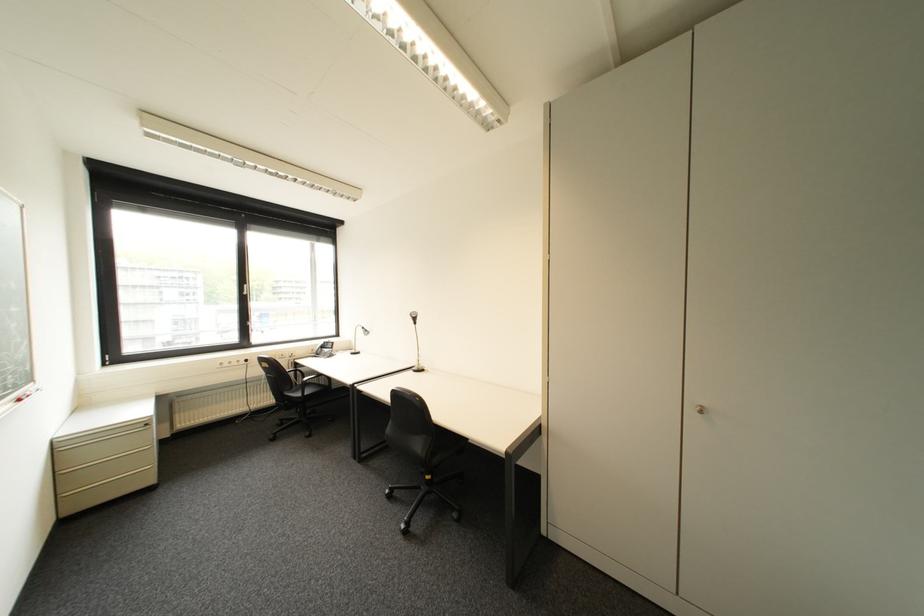
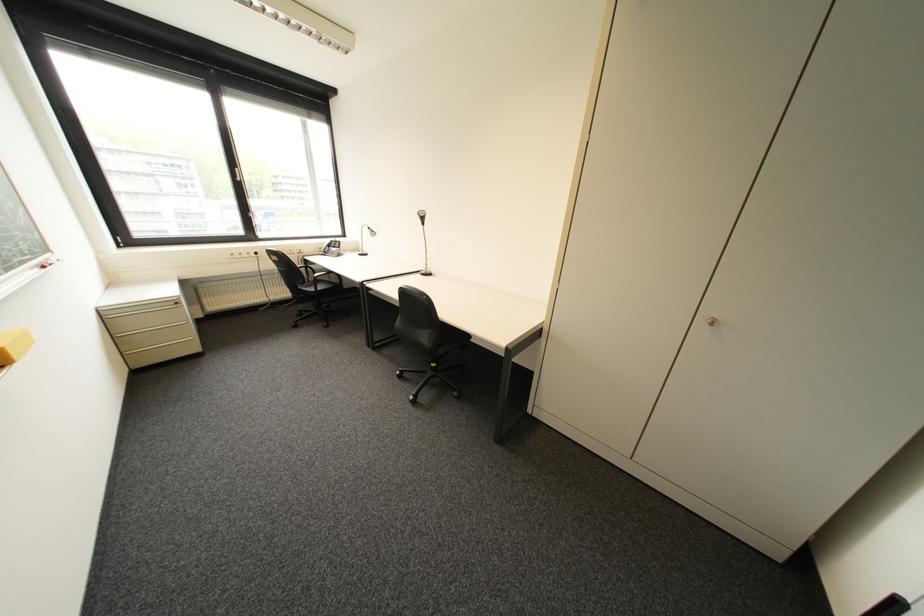
Locate, in the second image, the point that corresponds to (x=329, y=345) in the first image.

(335, 244)